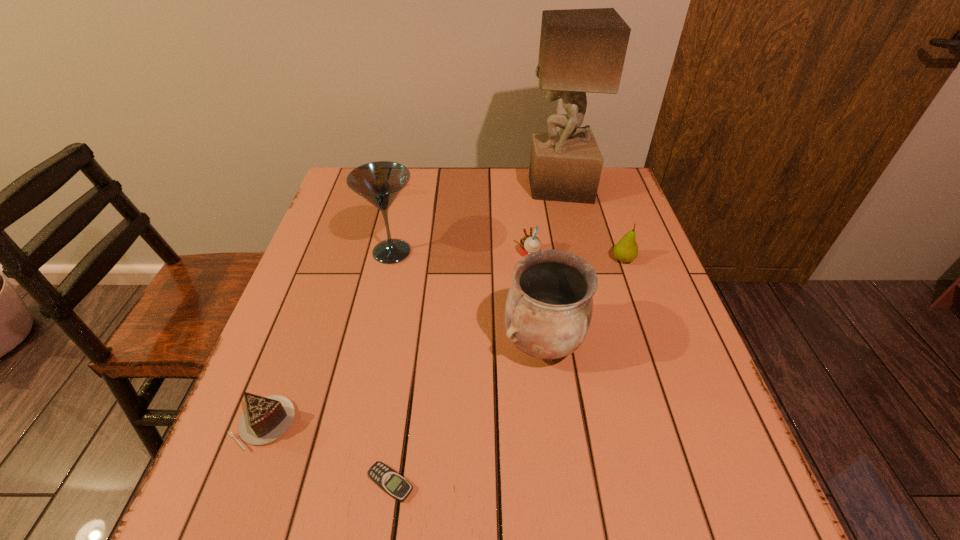
Point out which object is positioned as the nearest to the muffin. Please provide its 2D coordinates. Your answer should be formatted as a tuple, i.e. [(x, y)], where the tuple contains the x and y coordinates of a point satisfying the conditions above.

[(549, 306)]

The width and height of the screenshot is (960, 540). I want to click on the closest object to the leftmost object, so click(394, 484).

The image size is (960, 540). What are the coordinates of `free space that satisfies the following two spatial constraints: 1. on the front-facing side of the muffin; 2. on the front side of the nearest object` in the screenshot? It's located at (558, 483).

Find the location of a particular element. The height and width of the screenshot is (540, 960). vacant space that satisfies the following two spatial constraints: 1. on the front-facing side of the third shortest object; 2. on the left side of the urn is located at coordinates (540, 343).

This screenshot has height=540, width=960. Identify the location of vacant area in the image that satisfies the following two spatial constraints: 1. on the front-facing side of the muffin; 2. on the back side of the third nearest object. (540, 343).